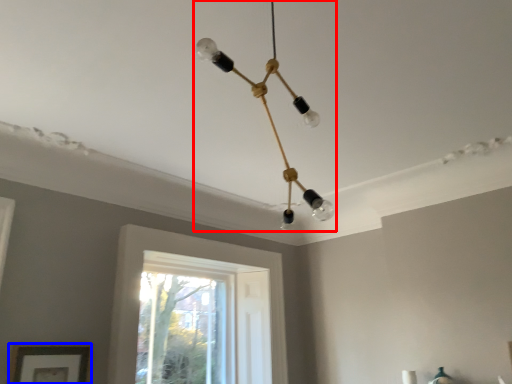
Question: Among these objects, which one is farthest to the camera, lamp (highlighted by a red box) or picture frame (highlighted by a blue box)?

Choices:
 (A) lamp
 (B) picture frame

Answer: (B)